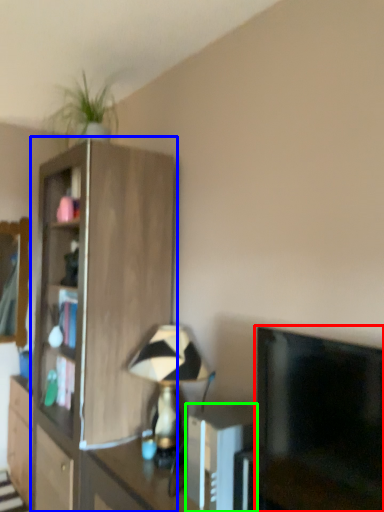
Question: Based on their relative distances, which object is farther from television (highlighted by a red box)? Choose from cupboard (highlighted by a blue box) and appliance (highlighted by a green box).

Choices:
 (A) cupboard
 (B) appliance

Answer: (A)